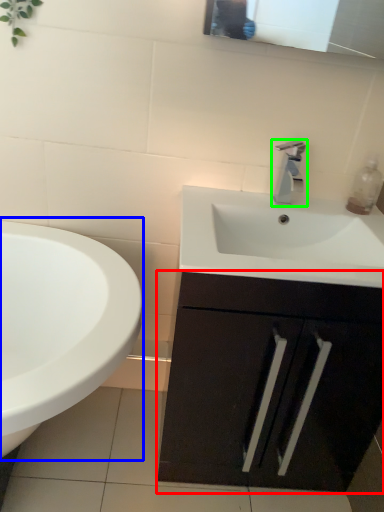
Question: Considering the real-world distances, which object is closest to bathroom cabinet (highlighted by a red box)? sink (highlighted by a blue box) or tap (highlighted by a green box).

Choices:
 (A) sink
 (B) tap

Answer: (A)